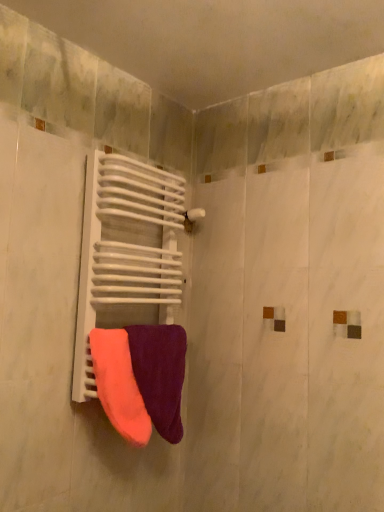
Question: In the image, is velvet purple towel at center, acting as the 1th towel starting from the right, on the left side or the right side of neon orange fabric towel at center, positioned as the first towel in left-to-right order?

Choices:
 (A) left
 (B) right

Answer: (B)

Question: In terms of width, does velvet purple towel at center, which appears as the second towel when viewed from the left, look wider or thinner when compared to neon orange fabric towel at center, the 2th towel from the right?

Choices:
 (A) wide
 (B) thin

Answer: (A)

Question: Which of these objects is positioned farthest from the white matte radiator at center?

Choices:
 (A) neon orange fabric towel at center, the 2th towel from the right
 (B) velvet purple towel at center, acting as the 1th towel starting from the right

Answer: (A)

Question: Estimate the real-world distances between objects in this image. Which object is farther from the white matte radiator at center?

Choices:
 (A) velvet purple towel at center, which appears as the second towel when viewed from the left
 (B) neon orange fabric towel at center, the 2th towel from the right

Answer: (B)